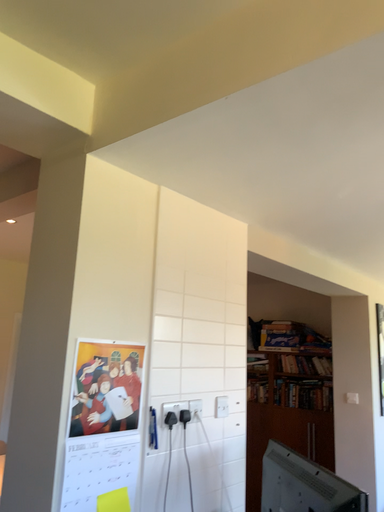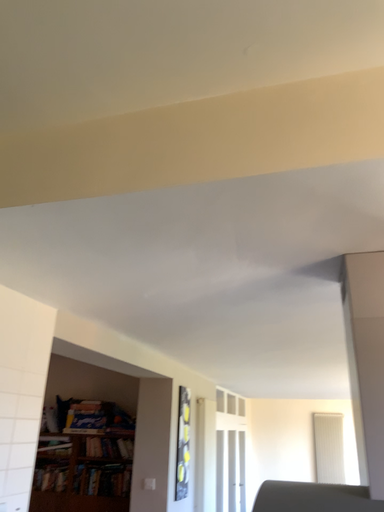
Question: How did the camera likely rotate when shooting the video?

Choices:
 (A) rotated right
 (B) rotated left

Answer: (A)